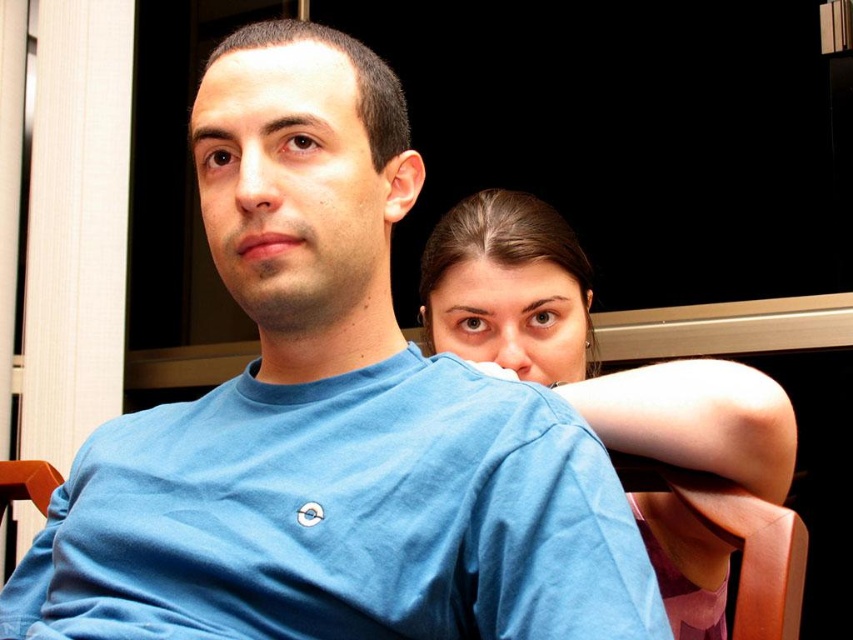
Question: Does smooth skin face at upper right appear under brown wood chair at lower right?

Choices:
 (A) no
 (B) yes

Answer: (A)

Question: Can you confirm if smooth skin face at upper right is smaller than brown wood chair at lower right?

Choices:
 (A) yes
 (B) no

Answer: (B)

Question: Which point appears closest to the camera in this image?

Choices:
 (A) (775, 508)
 (B) (482, 349)

Answer: (A)

Question: Does smooth skin face at upper right have a greater width compared to brown wood chair at lower right?

Choices:
 (A) no
 (B) yes

Answer: (B)